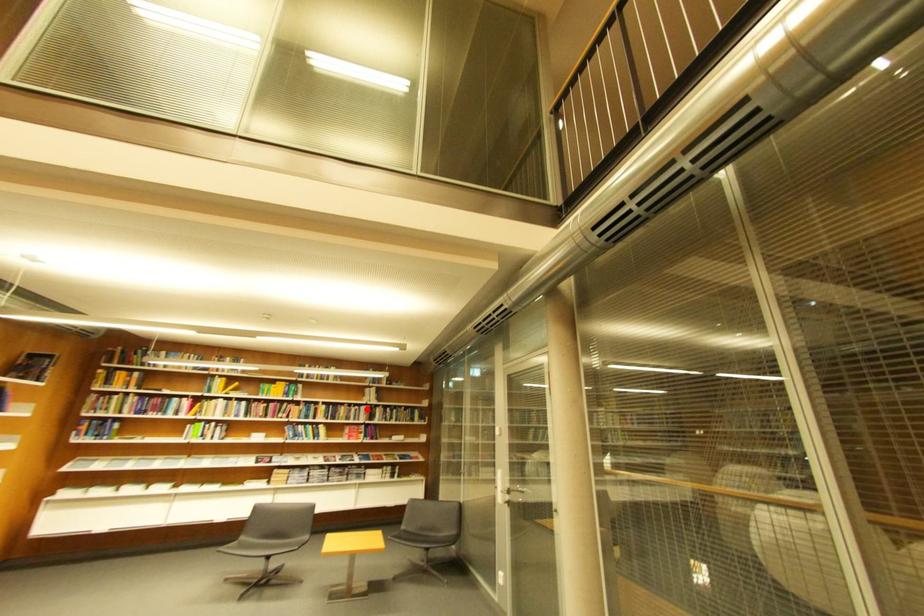
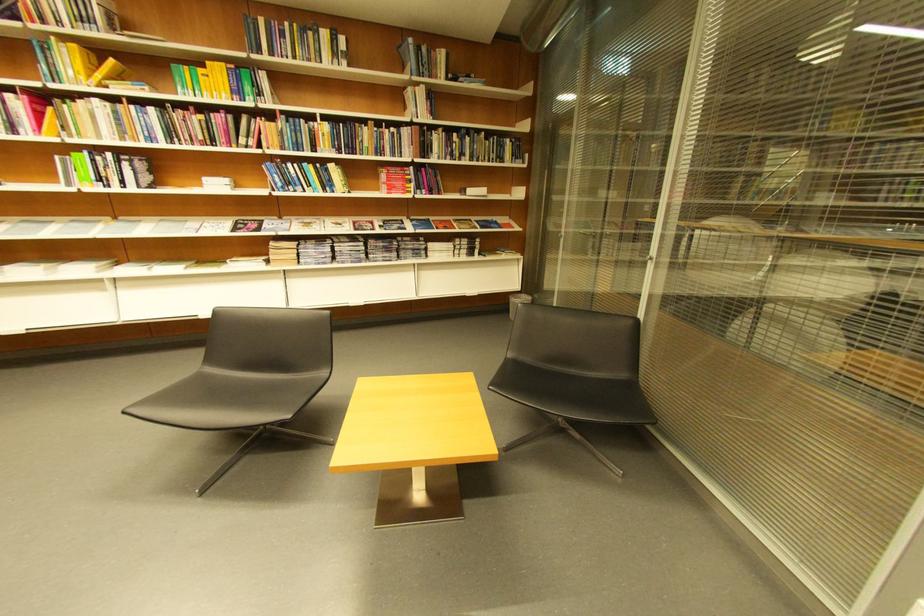
Locate, in the second image, the point that corresponds to the highlighted location in the first image.

(403, 131)